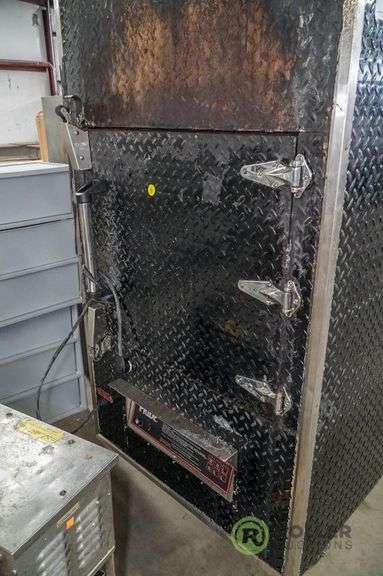
Locate an element on the screen. window is located at coordinates (24, 45).